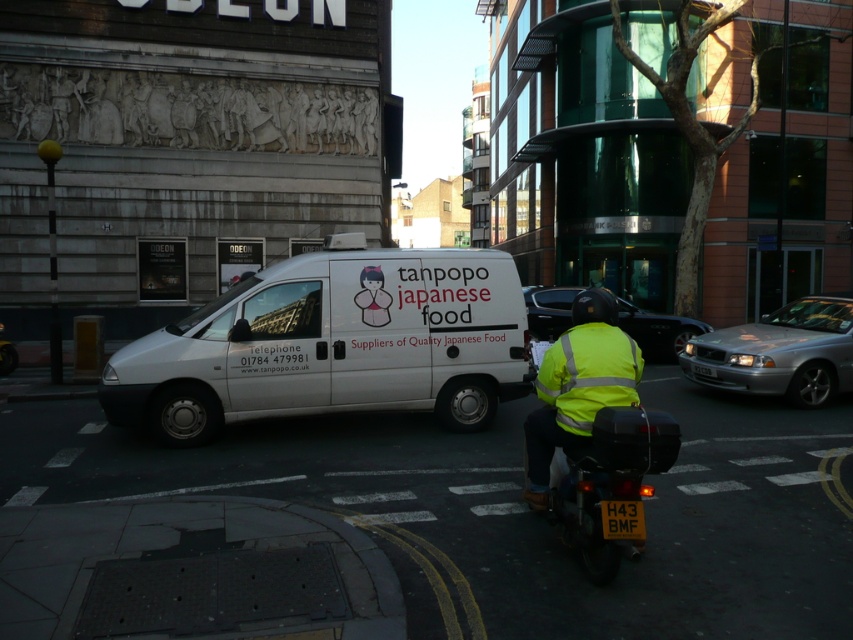
Question: Is white matte van at center below high visibility yellow jacket at center?

Choices:
 (A) yes
 (B) no

Answer: (B)

Question: Is high visibility yellow jacket at center positioned at the back of shiny black car at center?

Choices:
 (A) no
 (B) yes

Answer: (A)

Question: Which of the following is the farthest from the observer?

Choices:
 (A) (606, 476)
 (B) (811, 342)
 (C) (428, 403)
 (D) (553, 403)

Answer: (B)

Question: Which point is farther from the camera taking this photo?

Choices:
 (A) (102, 390)
 (B) (630, 397)

Answer: (A)

Question: Is high visibility yellow fabric safety vest at center bigger than shiny black car at center?

Choices:
 (A) no
 (B) yes

Answer: (B)

Question: Which point is farther to the camera?

Choices:
 (A) high visibility yellow jacket at center
 (B) high visibility yellow fabric safety vest at center

Answer: (B)